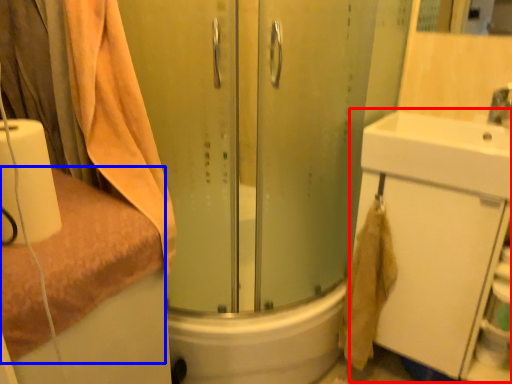
Question: Which of the following is the closest to the observer, bathroom cabinet (highlighted by a red box) or towel (highlighted by a blue box)?

Choices:
 (A) bathroom cabinet
 (B) towel

Answer: (B)